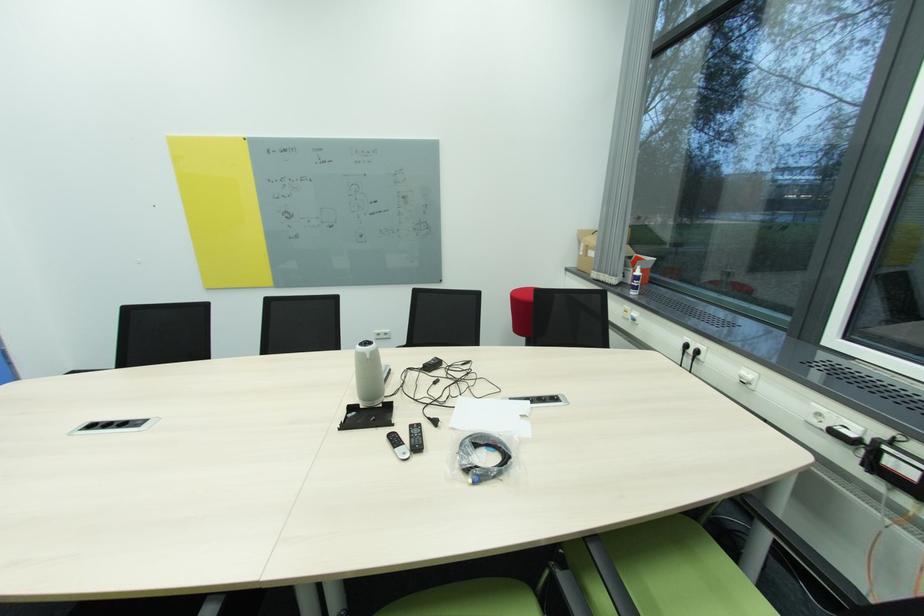
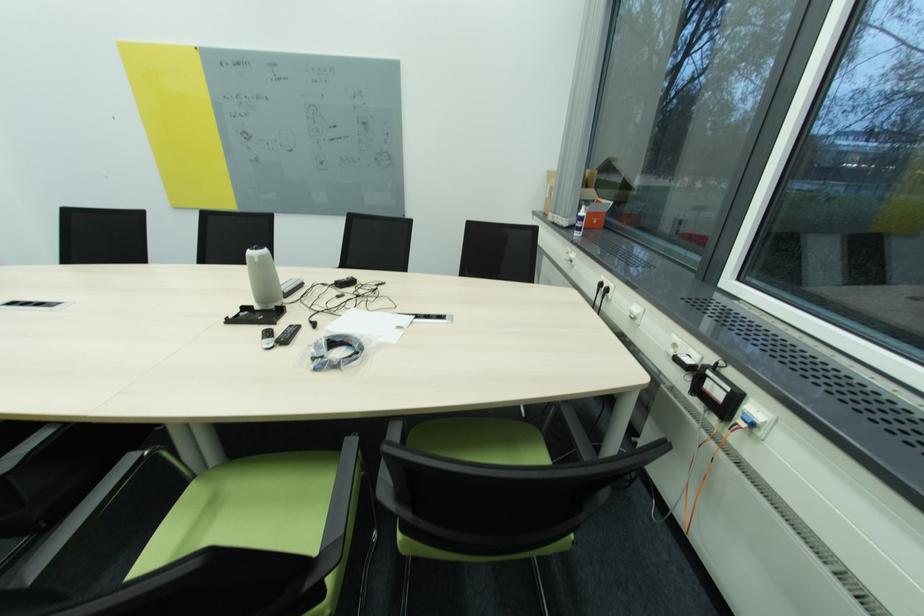
In the second image, find the point that corresponds to point 892,450 in the first image.

(713, 373)